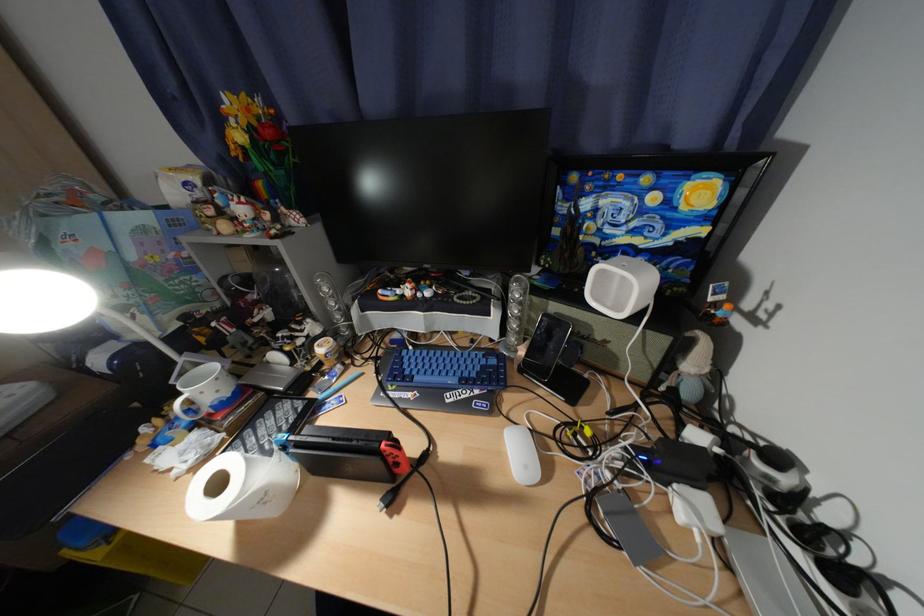
What are the coordinates of `white power adapter` in the screenshot? It's located at (695, 509).